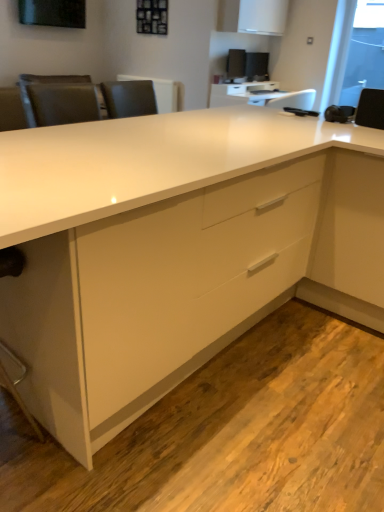
Question: From a real-world perspective, is white matte cabinet at upper center on transparent glass window screen at upper right?

Choices:
 (A) yes
 (B) no

Answer: (A)

Question: Is white matte cabinet at upper center oriented towards transparent glass window screen at upper right?

Choices:
 (A) no
 (B) yes

Answer: (B)

Question: Is white matte cabinet at upper center not within transparent glass window screen at upper right?

Choices:
 (A) yes
 (B) no

Answer: (A)

Question: Is white matte cabinet at upper center closer to camera compared to transparent glass window screen at upper right?

Choices:
 (A) no
 (B) yes

Answer: (B)

Question: Is white matte cabinet at upper center far away from transparent glass window screen at upper right?

Choices:
 (A) yes
 (B) no

Answer: (A)

Question: From the image's perspective, is white matte cabinet at upper center under transparent glass window screen at upper right?

Choices:
 (A) no
 (B) yes

Answer: (A)

Question: Is white glossy table at upper center in front of white matte cabinet at upper center?

Choices:
 (A) yes
 (B) no

Answer: (B)

Question: Considering the relative positions of white glossy table at upper center and white matte cabinet at upper center in the image provided, is white glossy table at upper center behind white matte cabinet at upper center?

Choices:
 (A) no
 (B) yes

Answer: (B)

Question: Considering the relative sizes of white glossy table at upper center and white matte cabinet at upper center in the image provided, is white glossy table at upper center bigger than white matte cabinet at upper center?

Choices:
 (A) yes
 (B) no

Answer: (A)

Question: Does white glossy table at upper center appear on the right side of white matte cabinet at upper center?

Choices:
 (A) no
 (B) yes

Answer: (B)

Question: Can you confirm if white glossy table at upper center is smaller than white matte cabinet at upper center?

Choices:
 (A) yes
 (B) no

Answer: (B)

Question: Can you confirm if white glossy table at upper center is wider than white matte cabinet at upper center?

Choices:
 (A) no
 (B) yes

Answer: (B)

Question: Would you say satin black monitor at upper center, which is counted as the 2th computer monitor, starting from the right, is outside transparent glass window screen at upper right?

Choices:
 (A) yes
 (B) no

Answer: (A)